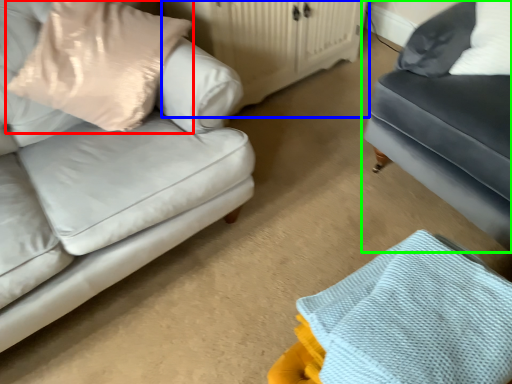
Question: Based on their relative distances, which object is nearer to pillow (highlighted by a red box)? Choose from dresser (highlighted by a blue box) and studio couch (highlighted by a green box).

Choices:
 (A) dresser
 (B) studio couch

Answer: (A)